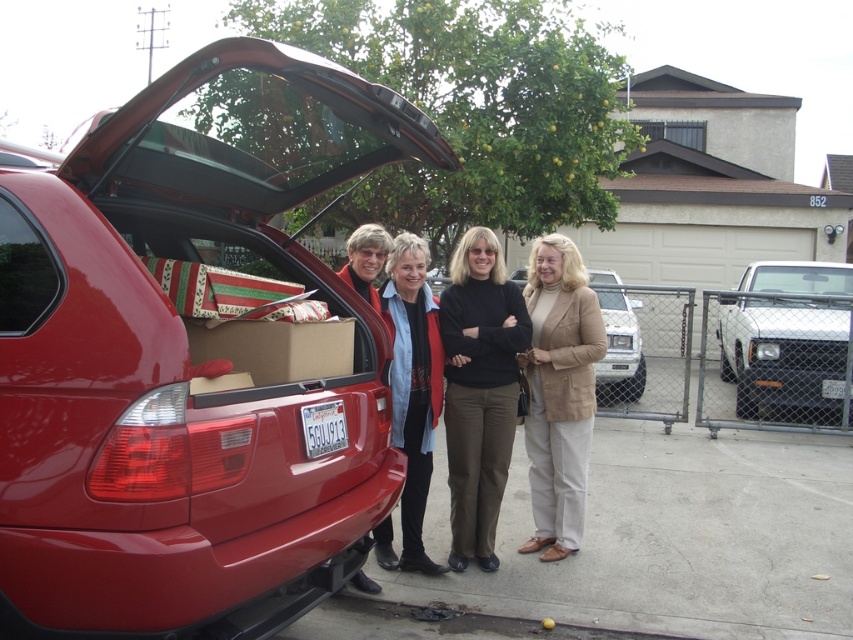
Question: Based on their relative distances, which object is nearer to the matte red jacket at center?

Choices:
 (A) brown cardboard box at center
 (B) shiny red car at center
 (C) dark brown pants at center

Answer: (C)

Question: Which of these objects is positioned closest to the matte red jacket at center?

Choices:
 (A) dark brown pants at center
 (B) shiny red car at center
 (C) black glossy truck at right
 (D) brown cardboard box at center

Answer: (A)

Question: Is shiny red car at center to the right of black glossy truck at right from the viewer's perspective?

Choices:
 (A) no
 (B) yes

Answer: (A)

Question: Among these points, which one is farthest from the camera?

Choices:
 (A) (819, 360)
 (B) (604, 275)
 (C) (529, 477)
 (D) (451, 428)

Answer: (B)

Question: Does shiny red car at center appear under matte red jacket at center?

Choices:
 (A) no
 (B) yes

Answer: (A)

Question: Can you confirm if black glossy truck at right is bigger than brown cardboard box at center?

Choices:
 (A) no
 (B) yes

Answer: (B)